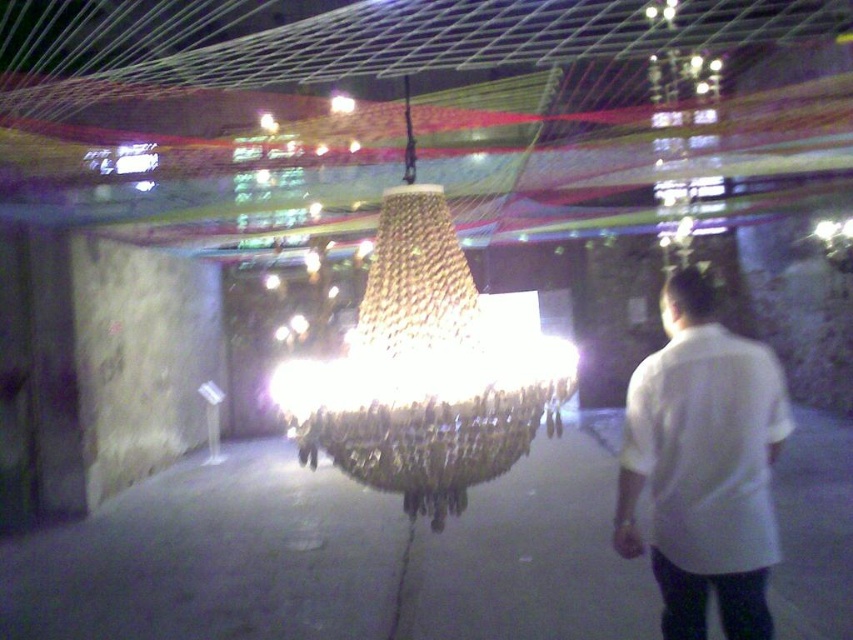
You are standing in the art installation and want to touch the white cotton shirt at right. The iridescent glass chandelier at center is in your way. Can you move around it to reach the shirt?

The iridescent glass chandelier at center is closer to the viewer than the white cotton shirt at right, so you can move around it to reach the shirt since it is between you and the shirt.

You are standing in the art installation and want to move from the point at coordinates point (x=436, y=323) to the point at coordinates point (x=648, y=483). Since you can only move forward, will you be able to reach the second point without moving sideways or backward?

Since point (x=436, y=323) is behind point (x=648, y=483), you cannot reach the second point by moving forward alone. You would need to adjust your direction or move sideways to get there.